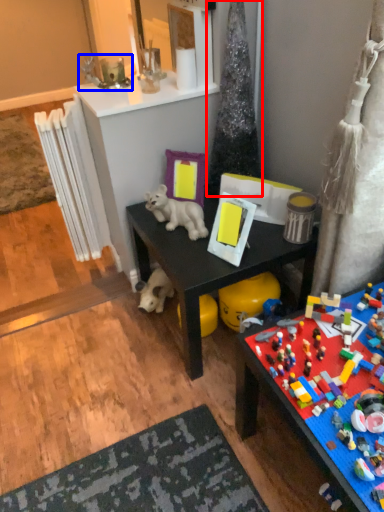
Question: Which of the following is the farthest to the observer, christmas tree (highlighted by a red box) or toy (highlighted by a blue box)?

Choices:
 (A) christmas tree
 (B) toy

Answer: (B)